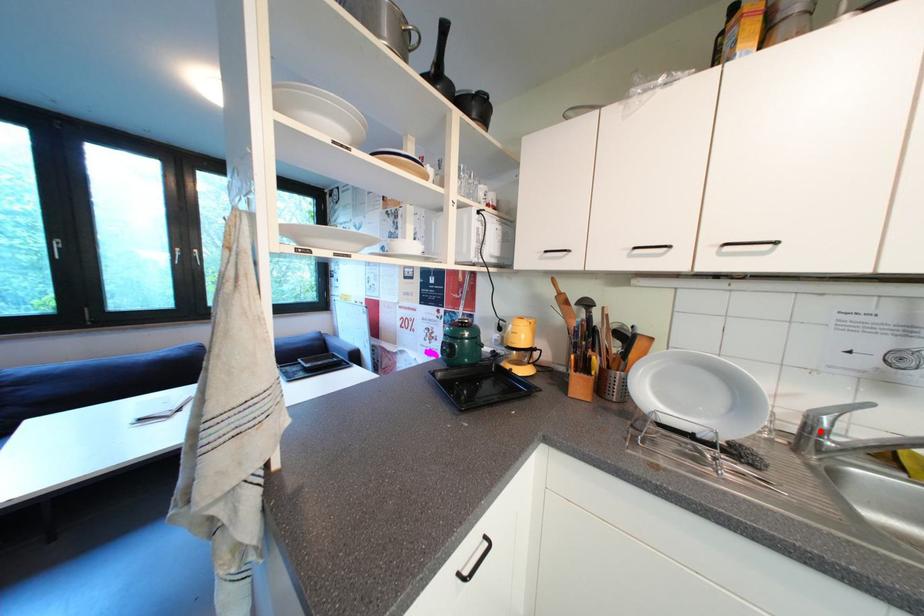
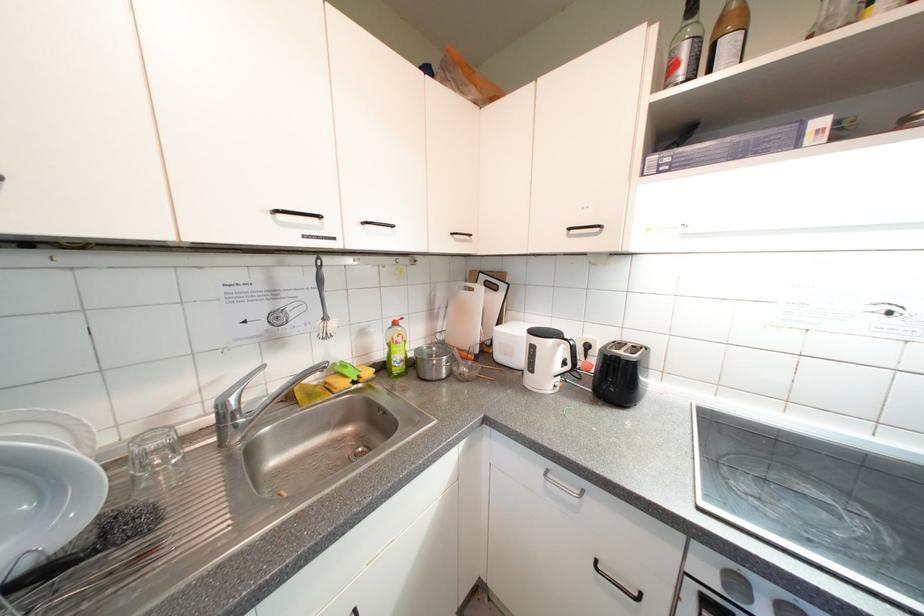
Find the pixel in the second image that matches the highlighted location in the first image.

(233, 419)